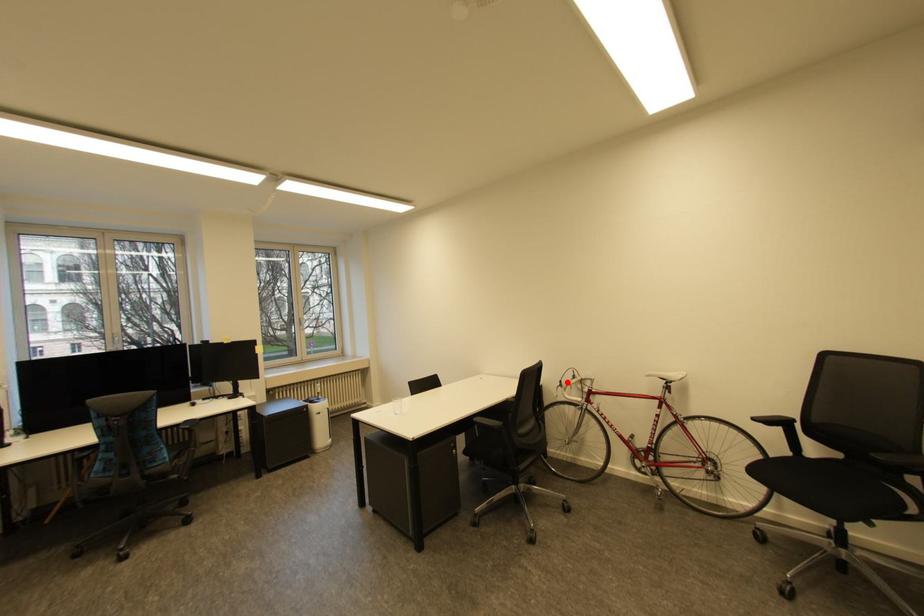
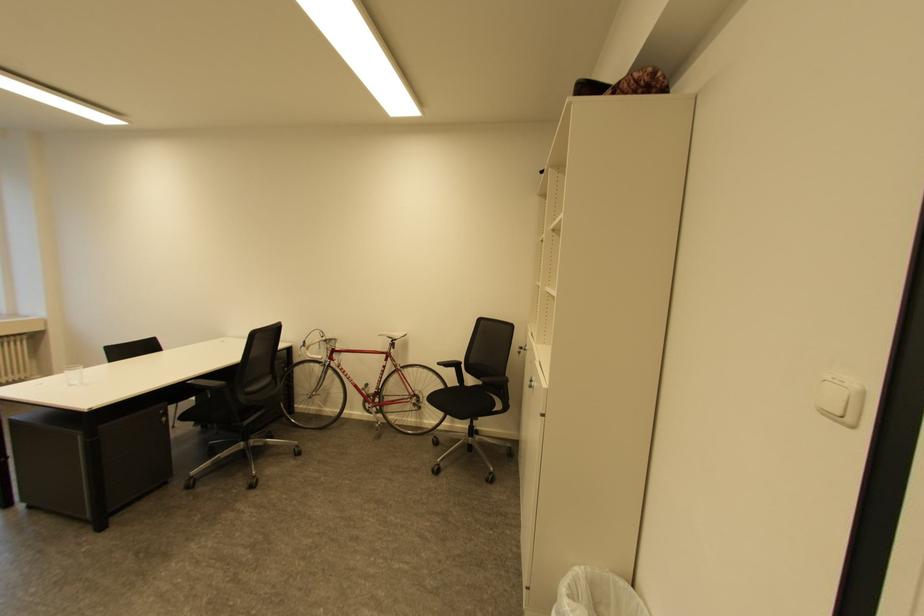
Question: I am providing you with two images of the same scene from different viewpoints. In image1, a red point is highlighted. Considering the same 3D point in image2, which of the following is correct?

Choices:
 (A) It is closer
 (B) It is farther

Answer: (A)